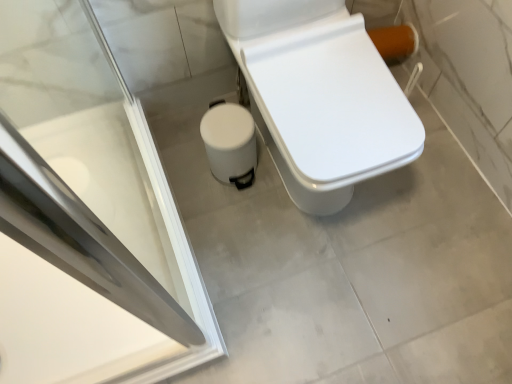
Question: Does white glossy toilet at center have a lesser width compared to white matte trash can at lower center?

Choices:
 (A) no
 (B) yes

Answer: (A)

Question: Is white glossy toilet at center directly adjacent to white matte trash can at lower center?

Choices:
 (A) yes
 (B) no

Answer: (B)

Question: Can you confirm if white glossy toilet at center is positioned to the left of white matte trash can at lower center?

Choices:
 (A) yes
 (B) no

Answer: (B)

Question: Considering the relative sizes of white glossy toilet at center and white matte trash can at lower center in the image provided, is white glossy toilet at center shorter than white matte trash can at lower center?

Choices:
 (A) yes
 (B) no

Answer: (B)

Question: Is white glossy toilet at center to the right of white matte trash can at lower center from the viewer's perspective?

Choices:
 (A) yes
 (B) no

Answer: (A)

Question: Is transparent glass screen door at upper left inside or outside of white glossy toilet at center?

Choices:
 (A) inside
 (B) outside

Answer: (B)

Question: Visually, is transparent glass screen door at upper left positioned to the left or to the right of white glossy toilet at center?

Choices:
 (A) left
 (B) right

Answer: (A)

Question: Considering their positions, is transparent glass screen door at upper left located in front of or behind white glossy toilet at center?

Choices:
 (A) behind
 (B) front

Answer: (B)

Question: Is point (10, 11) positioned closer to the camera than point (290, 140)?

Choices:
 (A) farther
 (B) closer

Answer: (A)

Question: From the image's perspective, is white matte trash can at lower center above or below transparent glass screen door at upper left?

Choices:
 (A) below
 (B) above

Answer: (A)

Question: Considering the positions of white matte trash can at lower center and transparent glass screen door at upper left in the image, is white matte trash can at lower center wider or thinner than transparent glass screen door at upper left?

Choices:
 (A) thin
 (B) wide

Answer: (A)

Question: Is white matte trash can at lower center in front of or behind transparent glass screen door at upper left in the image?

Choices:
 (A) behind
 (B) front

Answer: (A)

Question: Does point (232, 142) appear closer or farther from the camera than point (52, 104)?

Choices:
 (A) closer
 (B) farther

Answer: (A)

Question: Considering the relative positions of white matte trash can at lower center and white glossy toilet at center in the image provided, is white matte trash can at lower center to the left or to the right of white glossy toilet at center?

Choices:
 (A) left
 (B) right

Answer: (A)

Question: Considering the positions of point [233, 122] and point [381, 152], is point [233, 122] closer or farther from the camera than point [381, 152]?

Choices:
 (A) farther
 (B) closer

Answer: (A)